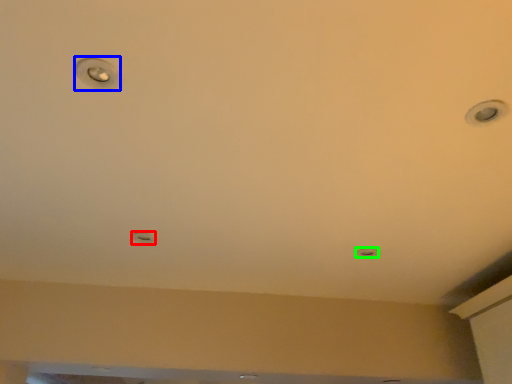
Question: Based on their relative distances, which object is farther from droplight (highlighted by a red box)? Choose from droplight (highlighted by a blue box) and light (highlighted by a green box).

Choices:
 (A) droplight
 (B) light

Answer: (B)